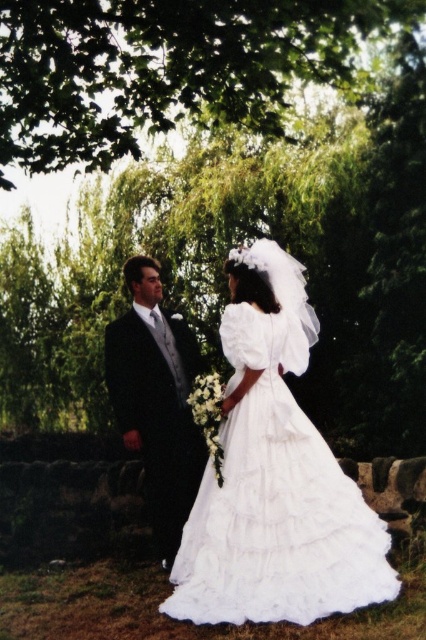
Between green leafy tree at upper center and shiny black suit at left, which one is positioned lower?

shiny black suit at left

Between green leafy tree at upper center and shiny black suit at left, which one has more height?

Standing taller between the two is shiny black suit at left.

Between point (340, 52) and point (187, 380), which one is positioned in front?

Point (187, 380) is more forward.

Identify the location of green leafy tree at upper center. (164, 68).

Which is below, white satin dress at center or shiny black suit at left?

shiny black suit at left is below.

Between white satin dress at center and shiny black suit at left, which one is positioned higher?

white satin dress at center is higher up.

At what (x,y) coordinates should I click in order to perform the action: click on white satin dress at center. Please return your answer as a coordinate pair (x, y). This screenshot has width=426, height=640. Looking at the image, I should click on (275, 476).

Which of these two, green leafy tree at upper center or white satin dress at center, stands shorter?

green leafy tree at upper center

Between green leafy tree at upper center and white satin dress at center, which one has more height?

white satin dress at center is taller.

Measure the distance between green leafy tree at upper center and camera.

green leafy tree at upper center is 17.70 feet from camera.

I want to click on green leafy tree at upper center, so (164, 68).